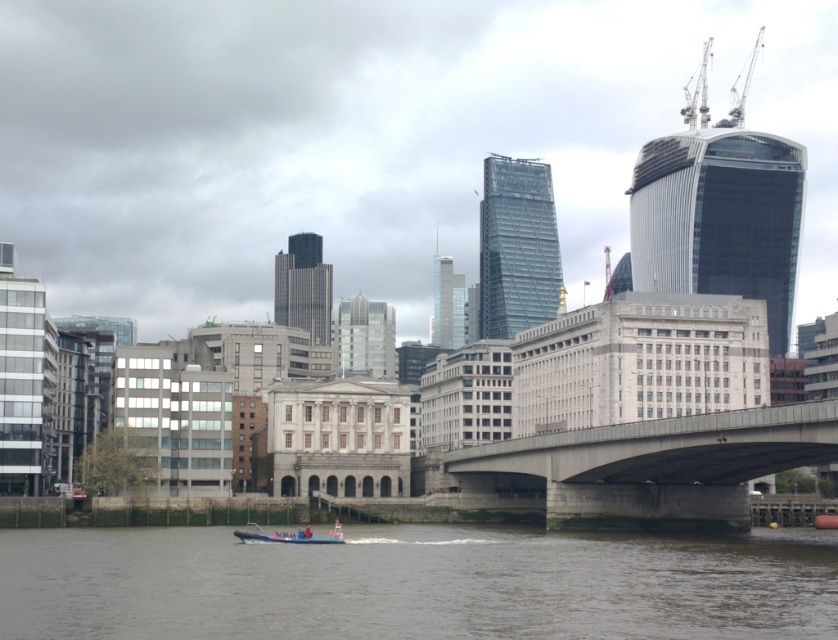
Question: Among these objects, which one is farthest from the camera?

Choices:
 (A) blue rubber boat at lower center
 (B) brown water at lower center

Answer: (A)

Question: Which of the following is the farthest from the observer?

Choices:
 (A) (304, 538)
 (B) (655, 492)

Answer: (B)

Question: Is brown water at lower center thinner than blue rubber boat at lower center?

Choices:
 (A) yes
 (B) no

Answer: (B)

Question: Observing the image, what is the correct spatial positioning of brown water at lower center in reference to concrete bridge at center?

Choices:
 (A) above
 (B) below

Answer: (B)

Question: Can you confirm if concrete bridge at center is positioned to the left of blue rubber boat at lower center?

Choices:
 (A) no
 (B) yes

Answer: (A)

Question: Which object is farther from the camera taking this photo?

Choices:
 (A) brown water at lower center
 (B) blue rubber boat at lower center
 (C) concrete bridge at center

Answer: (B)